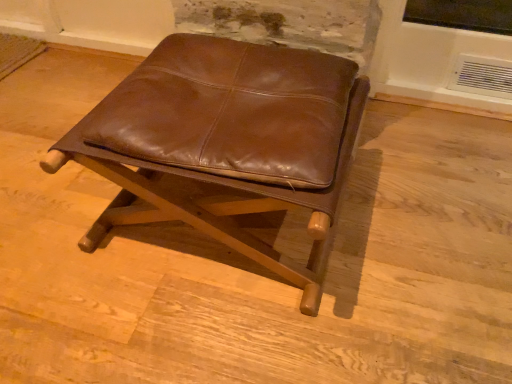
This screenshot has width=512, height=384. What do you see at coordinates (226, 141) in the screenshot?
I see `brown leather stool at center` at bounding box center [226, 141].

You are a GUI agent. You are given a task and a screenshot of the screen. Output one action in this format:
    pyautogui.click(x=<x>, y=<y>)
    Task: Click on the brown leather stool at center
    
    Given the screenshot: What is the action you would take?
    pyautogui.click(x=226, y=141)

Where is `brown leather stool at center`? The width and height of the screenshot is (512, 384). brown leather stool at center is located at coordinates (226, 141).